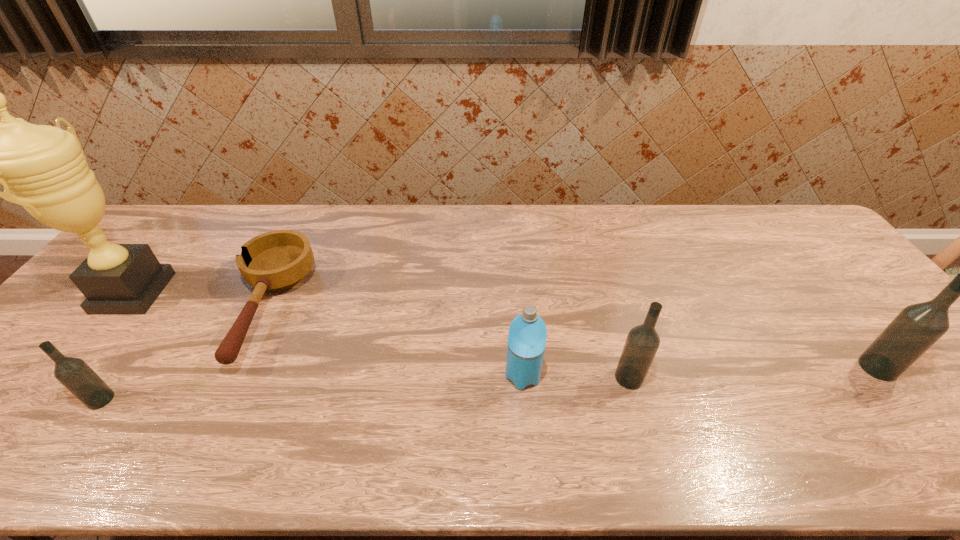
Locate an element on the screen. Image resolution: width=960 pixels, height=540 pixels. empty space that is in between the fifth tallest object and the tallest vodka is located at coordinates (490, 383).

This screenshot has height=540, width=960. I want to click on vacant point located between the second shortest object and the fourth object from left to right, so click(312, 388).

Find the location of `object that can be found as the second closest to the second object from left to right`. object that can be found as the second closest to the second object from left to right is located at coordinates (44, 167).

Locate which object is the fourth closest to the fourth object from left to right. Please provide its 2D coordinates. Your answer should be formatted as a tuple, i.e. [(x, y)], where the tuple contains the x and y coordinates of a point satisfying the conditions above.

[(75, 374)]

Identify which vodka is located as the third nearest to the third object from left to right. Please provide its 2D coordinates. Your answer should be formatted as a tuple, i.e. [(x, y)], where the tuple contains the x and y coordinates of a point satisfying the conditions above.

[(917, 327)]

Locate an element on the screen. This screenshot has width=960, height=540. vodka that is the second closest to the second object from left to right is located at coordinates (917, 327).

You are a GUI agent. You are given a task and a screenshot of the screen. Output one action in this format:
    pyautogui.click(x=<x>, y=<y>)
    Task: Click on the vacant region that satisfies the following two spatial constraints: 1. with the handle on the side of the second tallest vodka; 2. on the left side of the saucepan
    The height and width of the screenshot is (540, 960).
    Given the screenshot: What is the action you would take?
    pyautogui.click(x=233, y=378)

Locate an element on the screen. free spot that satisfies the following two spatial constraints: 1. at the front of the second vodka from left to right with handles; 2. on the right side of the leftmost object is located at coordinates (65, 378).

You are a GUI agent. You are given a task and a screenshot of the screen. Output one action in this format:
    pyautogui.click(x=<x>, y=<y>)
    Task: Click on the free space that satisfies the following two spatial constraints: 1. on the back side of the rightmost object; 2. on the left side of the third object from right to left
    This screenshot has width=960, height=540.
    Given the screenshot: What is the action you would take?
    pyautogui.click(x=522, y=368)

I want to click on free space in the image that satisfies the following two spatial constraints: 1. at the front of the thermos bottle with handles; 2. on the left side of the tallest object, so click(66, 376).